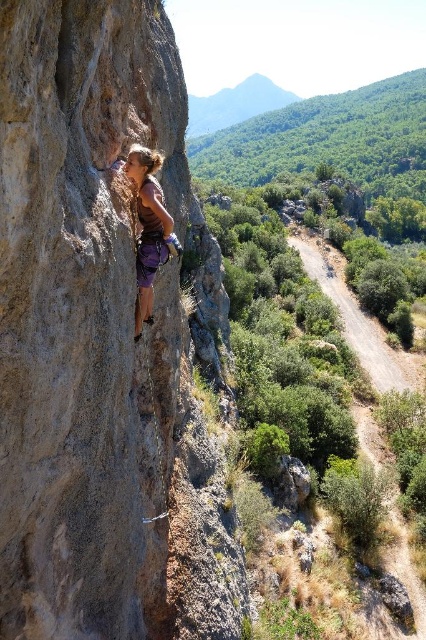
Question: Which point is closer to the camera?

Choices:
 (A) brown rough rock at left
 (B) purple fabric climbing harness at center

Answer: (A)

Question: Can you confirm if brown rough rock at left is positioned to the left of purple fabric climbing harness at center?

Choices:
 (A) no
 (B) yes

Answer: (A)

Question: Does brown rough rock at left lie in front of purple fabric climbing harness at center?

Choices:
 (A) no
 (B) yes

Answer: (B)

Question: Can you confirm if brown rough rock at left is positioned to the left of purple fabric climbing harness at center?

Choices:
 (A) no
 (B) yes

Answer: (A)